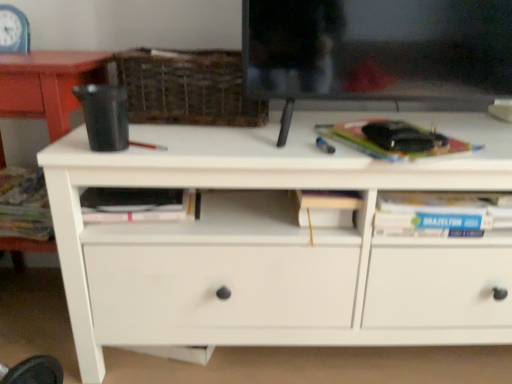
The height and width of the screenshot is (384, 512). In order to click on free space in front of woven brown basket at upper center in this screenshot , I will do `click(197, 137)`.